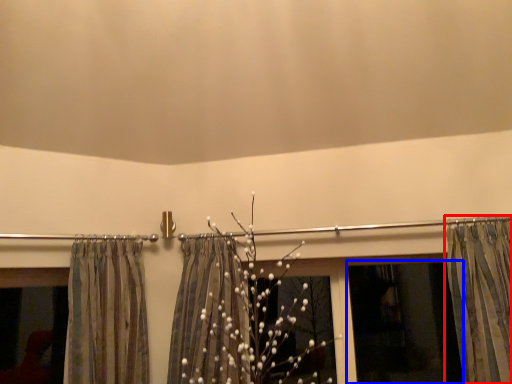
Question: Among these objects, which one is farthest to the camera, curtain (highlighted by a red box) or window screen (highlighted by a blue box)?

Choices:
 (A) curtain
 (B) window screen

Answer: (B)